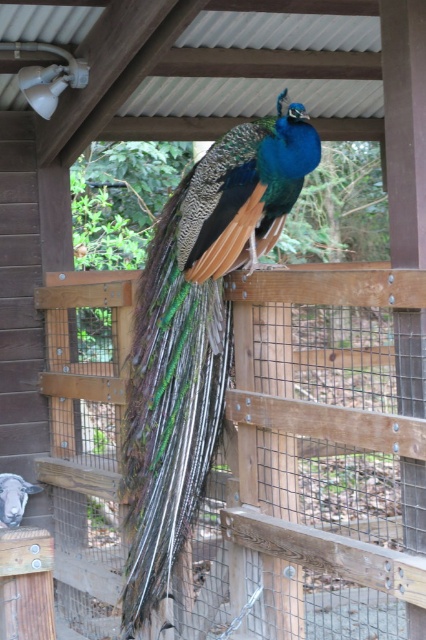
Question: Is wooden fence at center further to camera compared to shiny iridescent peacock at center?

Choices:
 (A) no
 (B) yes

Answer: (A)

Question: Which of the following is the closest to the observer?

Choices:
 (A) (213, 502)
 (B) (244, 216)

Answer: (B)

Question: Can you confirm if wooden fence at center is thinner than shiny iridescent peacock at center?

Choices:
 (A) no
 (B) yes

Answer: (A)

Question: Which of the following is the farthest from the observer?

Choices:
 (A) (425, 566)
 (B) (160, 381)

Answer: (B)

Question: Is wooden fence at center behind shiny iridescent peacock at center?

Choices:
 (A) yes
 (B) no

Answer: (B)

Question: Which point is closer to the camera taking this photo?

Choices:
 (A) (348, 326)
 (B) (239, 182)

Answer: (A)